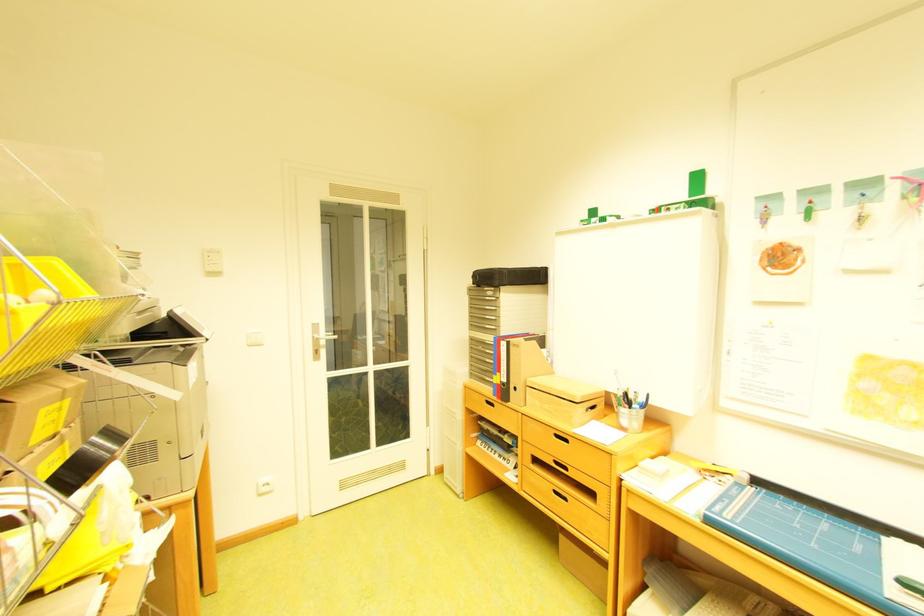
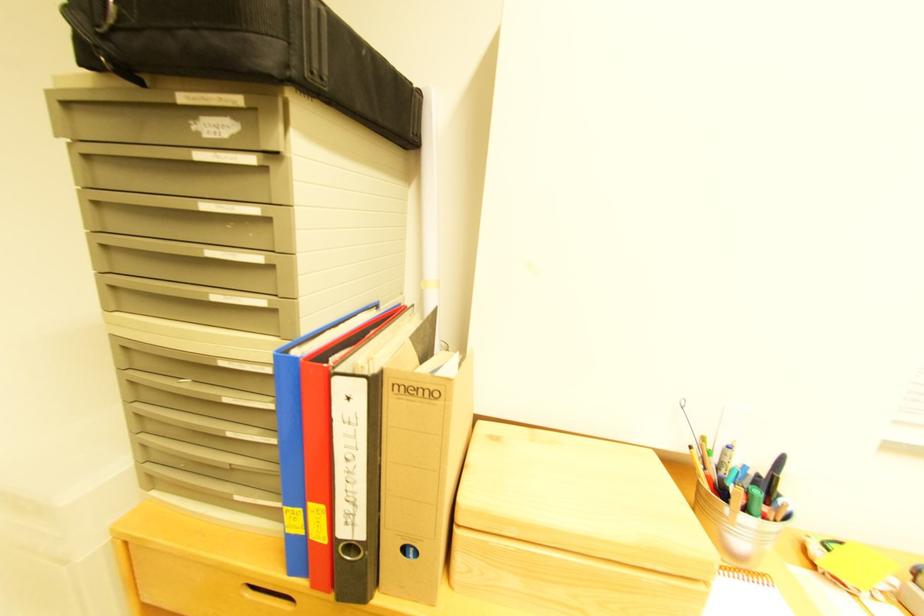
Find the pixel in the second image that matches (x=499, y=328) in the first image.

(228, 298)